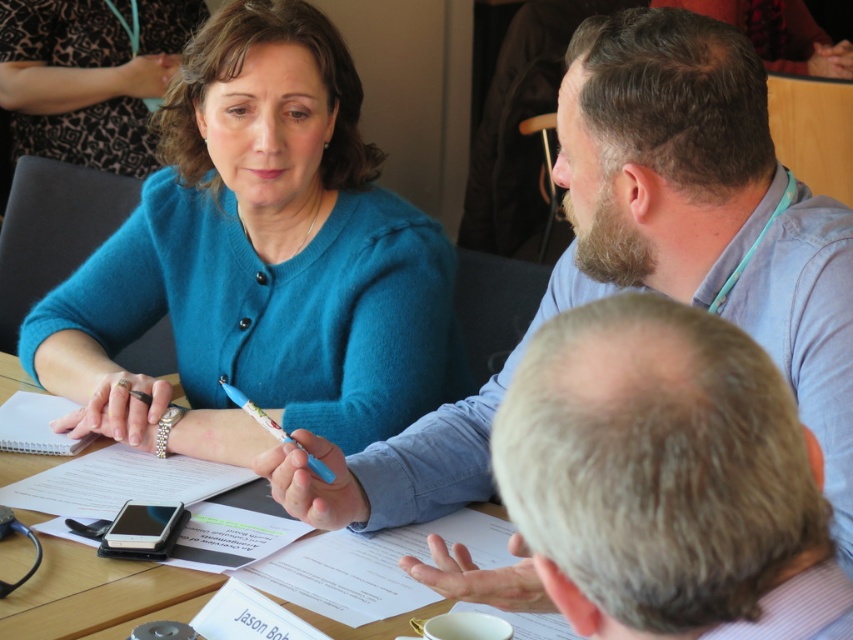
Question: Which object appears farthest from the camera in this image?

Choices:
 (A) gray hair at upper center
 (B) blue plastic pen at center
 (C) wooden table at center

Answer: (B)

Question: Is wooden table at center thinner than blue plastic pen at center?

Choices:
 (A) yes
 (B) no

Answer: (B)

Question: Is blue fabric shirt at upper center bigger than wooden table at center?

Choices:
 (A) no
 (B) yes

Answer: (B)

Question: Does teal fuzzy sweater at upper left lie behind gray hair at upper center?

Choices:
 (A) yes
 (B) no

Answer: (A)

Question: Which object is closer to the camera taking this photo?

Choices:
 (A) blue plastic pen at center
 (B) teal fuzzy sweater at upper left
 (C) gray hair at upper center
 (D) white paper notepad at upper left

Answer: (C)

Question: Among these points, which one is nearest to the camera?

Choices:
 (A) (233, 54)
 (B) (62, 568)
 (C) (15, 417)

Answer: (B)